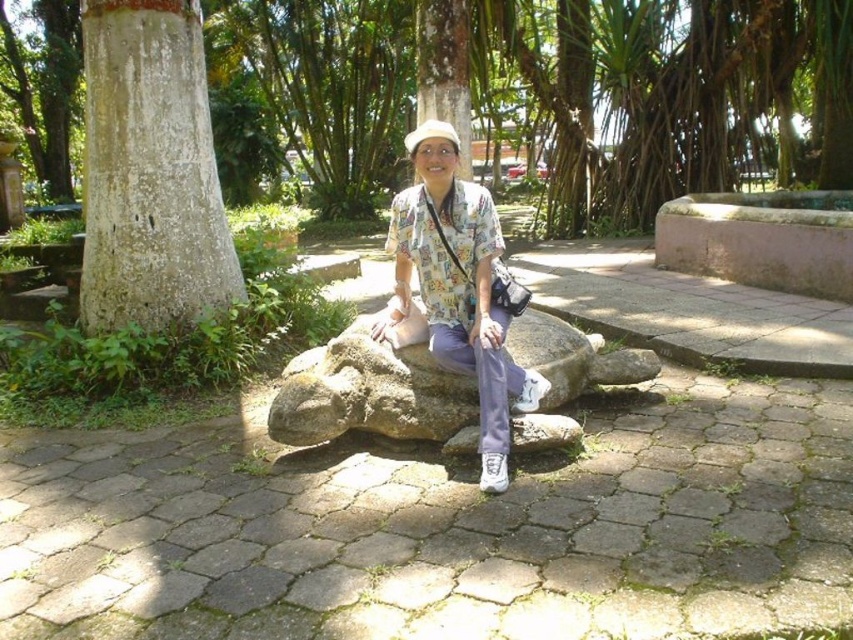
Measure the distance between point (426,161) and camera.

A distance of 11.02 feet exists between point (426,161) and camera.

Does printed cotton shirt at center lie in front of white fabric hat at center?

Yes, it is.

This screenshot has width=853, height=640. In order to click on printed cotton shirt at center in this screenshot , I will do `click(461, 292)`.

What do you see at coordinates (671, 93) in the screenshot? I see `rough bark tree at center` at bounding box center [671, 93].

Between rough bark tree at center and white rough bark tree at left, which one has more height?

rough bark tree at center is taller.

Image resolution: width=853 pixels, height=640 pixels. What do you see at coordinates (671, 93) in the screenshot?
I see `rough bark tree at center` at bounding box center [671, 93].

You are a GUI agent. You are given a task and a screenshot of the screen. Output one action in this format:
    pyautogui.click(x=<x>, y=<y>)
    Task: Click on the rough bark tree at center
    
    Given the screenshot: What is the action you would take?
    pyautogui.click(x=671, y=93)

Between point (177, 284) and point (440, 234), which one is positioned in front?

Point (440, 234)

Does point (165, 291) come farther from viewer compared to point (514, 308)?

Yes.

This screenshot has width=853, height=640. What are the coordinates of `white rough bark tree at left` in the screenshot? It's located at (149, 170).